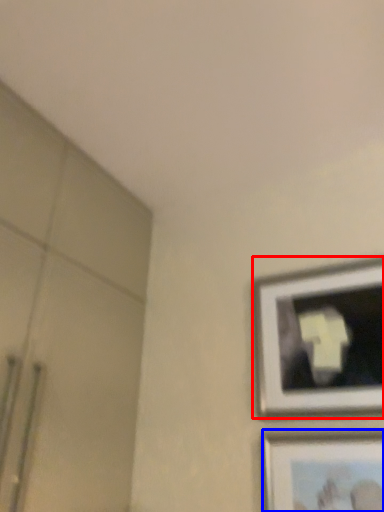
Question: Which point is further to the camera, picture frame (highlighted by a red box) or picture frame (highlighted by a blue box)?

Choices:
 (A) picture frame
 (B) picture frame

Answer: (A)